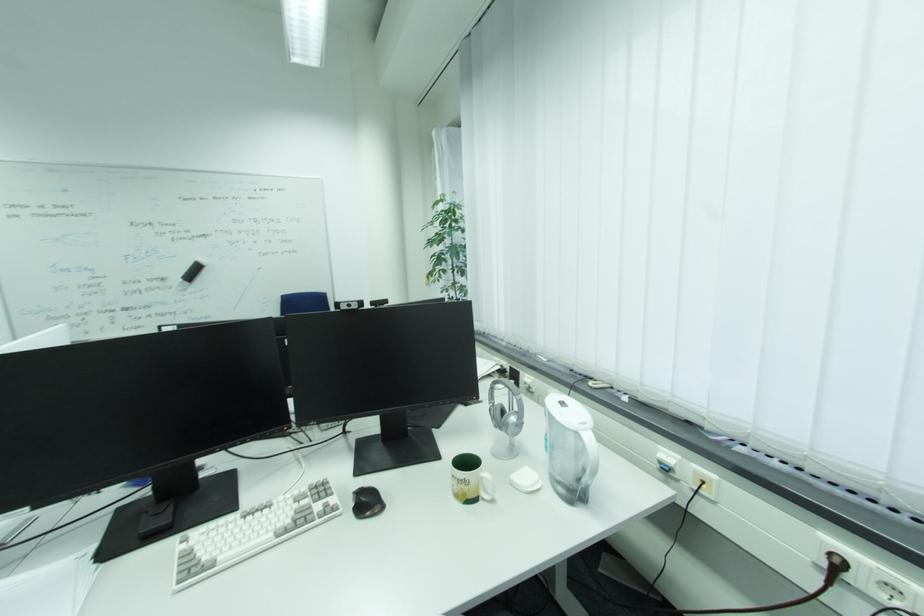
Image resolution: width=924 pixels, height=616 pixels. Identify the location of white pitcher lid. (567, 411).